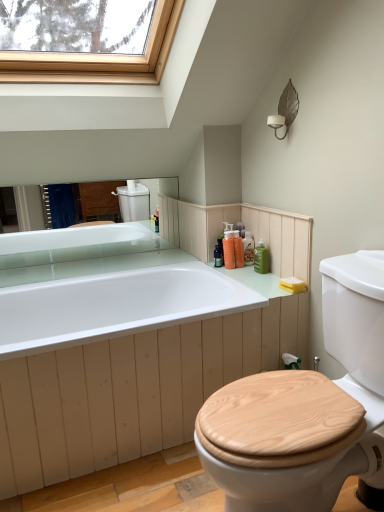
This screenshot has width=384, height=512. What are the coordinates of `free area behind yellow sponge at right` in the screenshot? It's located at click(x=273, y=278).